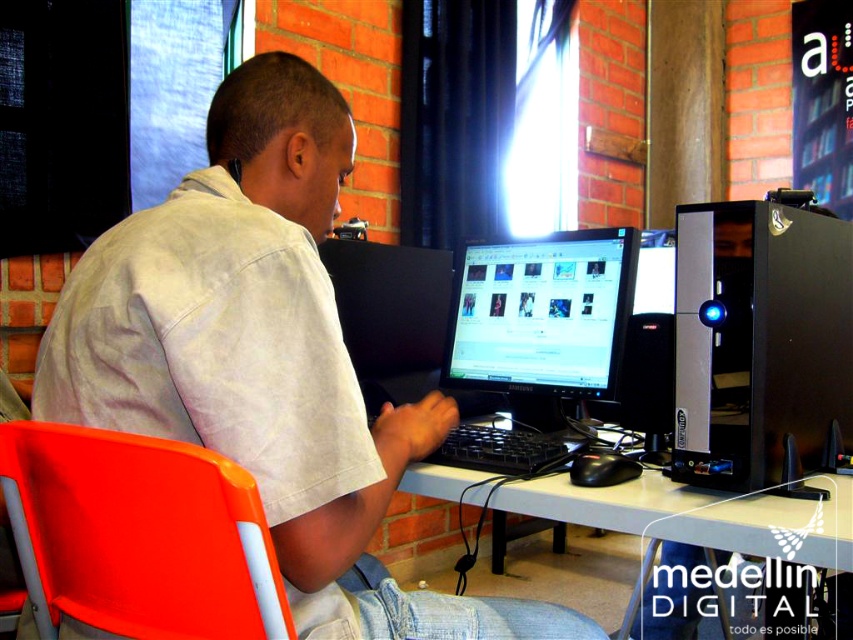
Is matte white shirt at center bigger than orange plastic chair at lower left?

Correct, matte white shirt at center is larger in size than orange plastic chair at lower left.

Is matte white shirt at center above orange plastic chair at lower left?

Indeed, matte white shirt at center is positioned over orange plastic chair at lower left.

Find the location of `matte white shirt at center`. matte white shirt at center is located at coordinates (265, 358).

Where is `matte white shirt at center`? matte white shirt at center is located at coordinates (265, 358).

Is matte white shirt at center closer to the viewer compared to black plastic desktop computer at right?

Yes.

Does matte white shirt at center appear on the right side of black plastic desktop computer at right?

No, matte white shirt at center is not to the right of black plastic desktop computer at right.

Is point (318, 470) farther from camera compared to point (721, 224)?

No, it is in front of (721, 224).

This screenshot has height=640, width=853. In order to click on matte white shirt at center in this screenshot , I will do `click(265, 358)`.

Is matte white shirt at center shorter than black glossy monitor at center?

No, matte white shirt at center is not shorter than black glossy monitor at center.

Is matte white shirt at center bigger than black glossy monitor at center?

Correct, matte white shirt at center is larger in size than black glossy monitor at center.

Which is in front, point (310, 404) or point (558, 387)?

Point (310, 404) is more forward.

Identify the location of matte white shirt at center. The image size is (853, 640). (265, 358).